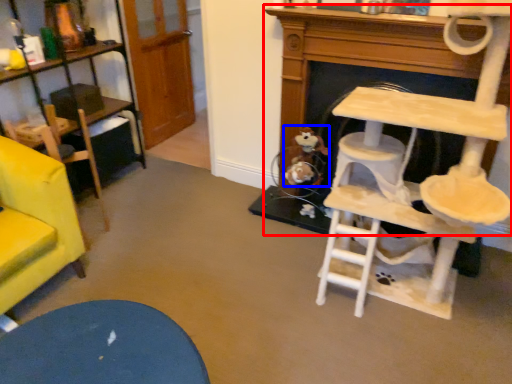
Question: Among these objects, which one is farthest to the camera, fireplace (highlighted by a red box) or toy (highlighted by a blue box)?

Choices:
 (A) fireplace
 (B) toy

Answer: (B)